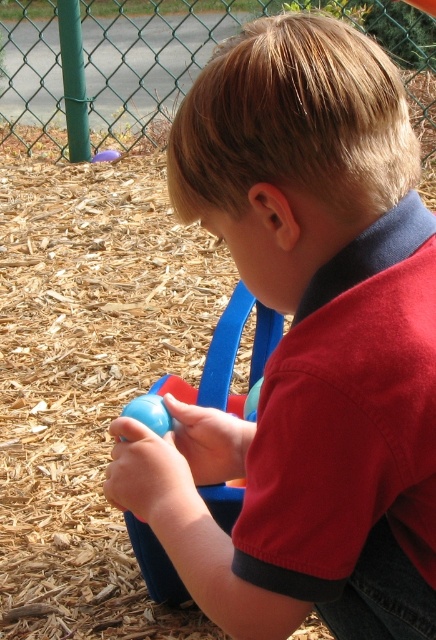
Question: Among these points, which one is farthest from the camera?

Choices:
 (A) (111, 161)
 (B) (237, 492)

Answer: (A)

Question: Does matte plastic ball at center have a lesser width compared to matte blue ball at lower center?

Choices:
 (A) no
 (B) yes

Answer: (A)

Question: Does matte plastic ball at center appear on the left side of matte blue ball at lower center?

Choices:
 (A) yes
 (B) no

Answer: (B)

Question: Which point is farther to the camera?

Choices:
 (A) matte plastic ball at center
 (B) matte blue ball at lower center

Answer: (B)

Question: Can you confirm if matte plastic ball at center is wider than matte blue ball at lower center?

Choices:
 (A) no
 (B) yes

Answer: (B)

Question: Which point appears closest to the camera in this image?

Choices:
 (A) (218, 371)
 (B) (112, 161)

Answer: (A)